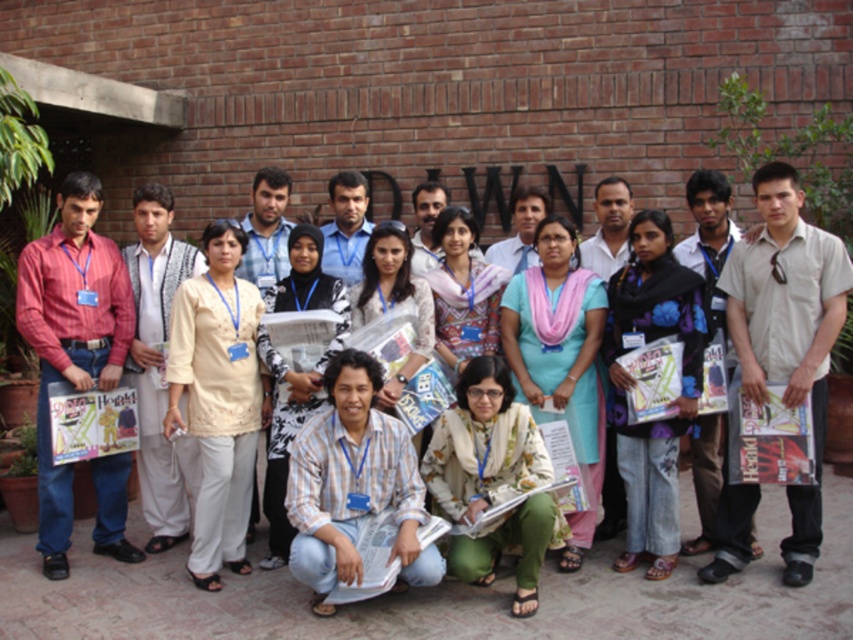
Question: Does beige cotton shirt at center have a larger size compared to pink floral scarf at center?

Choices:
 (A) yes
 (B) no

Answer: (A)

Question: Which point is farther to the camera?

Choices:
 (A) (335, 381)
 (B) (503, 444)
 (C) (811, 556)
 (D) (146, 433)

Answer: (D)

Question: Does light brown striped shirt at lower center appear on the left side of beige cotton shirt at center?

Choices:
 (A) yes
 (B) no

Answer: (B)

Question: Which object appears closest to the camera in this image?

Choices:
 (A) beige cotton shirt at center
 (B) floral fabric scarf at center
 (C) matte red shirt at left

Answer: (B)

Question: Does light beige shirt at center have a greater width compared to light blue fabric scarf at center?

Choices:
 (A) no
 (B) yes

Answer: (B)

Question: Which point appears farthest from the camera in this image?

Choices:
 (A) (471, 572)
 (B) (621, 321)

Answer: (B)